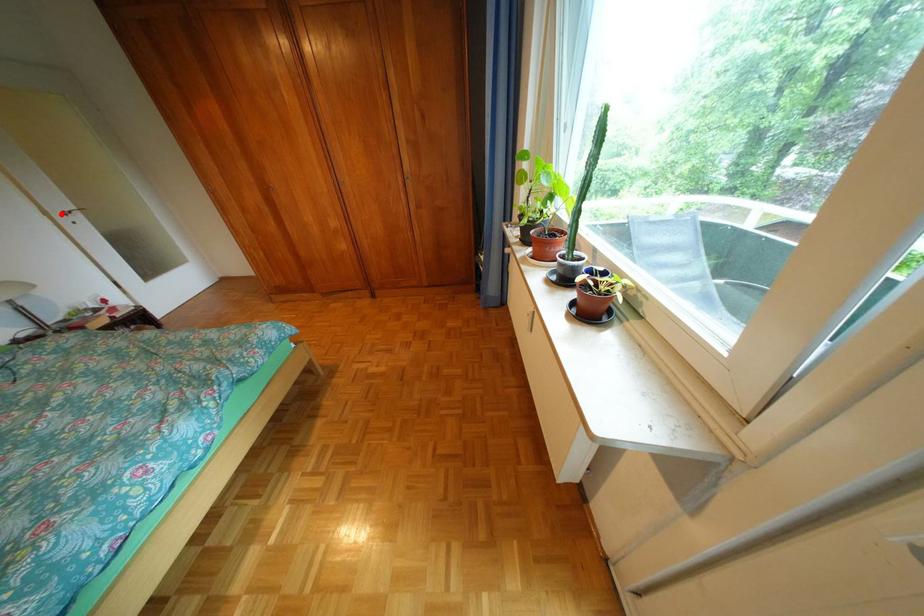
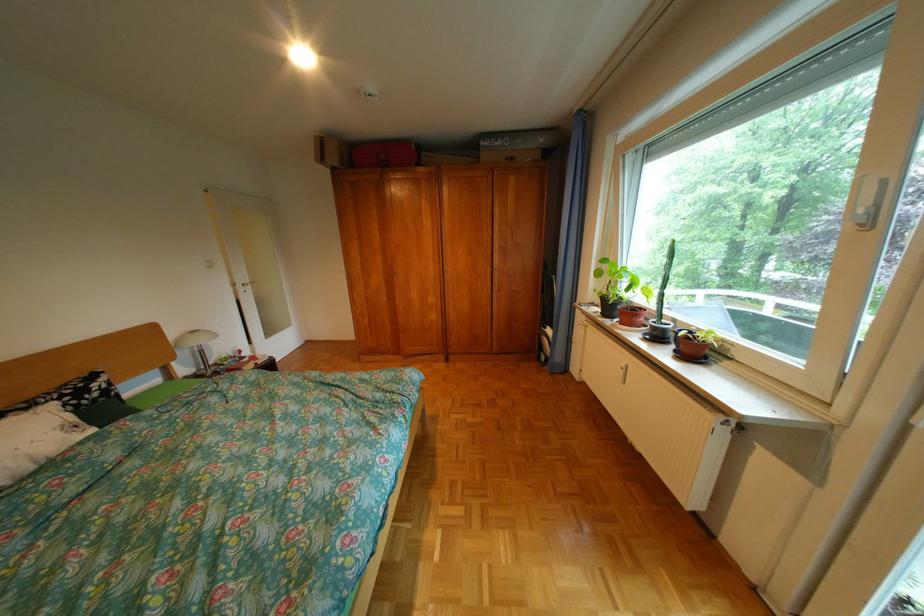
Where in the second image is the point corresponding to the highlighted location from the first image?

(248, 285)